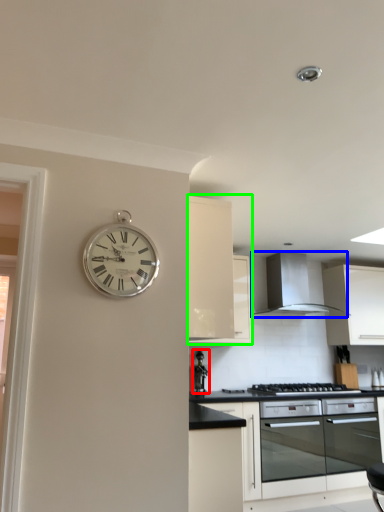
Question: Based on their relative distances, which object is nearer to appliance (highlighted by a red box)? Choose from exhaust hood (highlighted by a blue box) and cabinetry (highlighted by a green box).

Choices:
 (A) exhaust hood
 (B) cabinetry

Answer: (A)